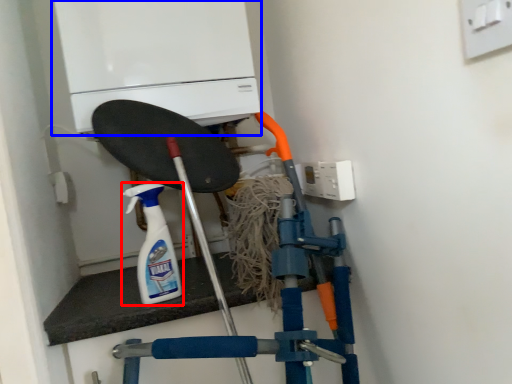
Question: Among these objects, which one is farthest to the camera, cleaning product (highlighted by a red box) or home appliance (highlighted by a blue box)?

Choices:
 (A) cleaning product
 (B) home appliance

Answer: (B)